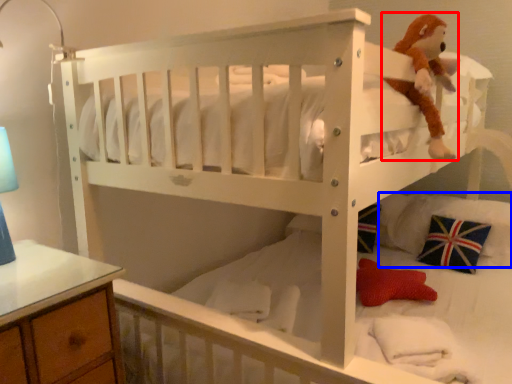
Question: Among these objects, which one is farthest to the camera, toy (highlighted by a red box) or pillow (highlighted by a blue box)?

Choices:
 (A) toy
 (B) pillow

Answer: (B)